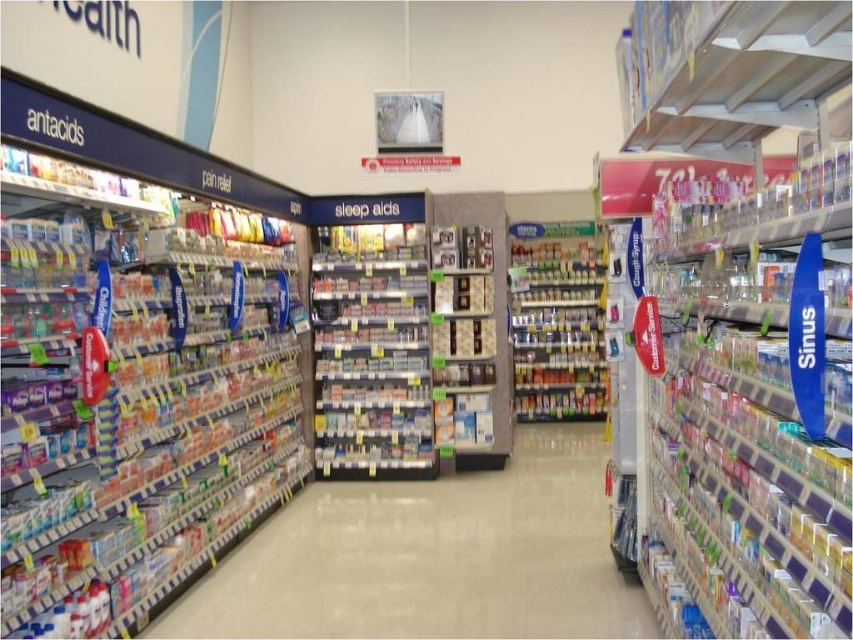
Question: Does white plastic shelves at center appear on the right side of metallic silver spice rack at center?

Choices:
 (A) yes
 (B) no

Answer: (B)

Question: Is white plastic shelves at center smaller than metallic silver spice rack at center?

Choices:
 (A) yes
 (B) no

Answer: (B)

Question: Which of these objects is positioned closest to the metallic silver spice rack at center?

Choices:
 (A) matte plastic antacids at left
 (B) white plastic shelves at center

Answer: (B)

Question: Which is farther from the matte plastic antacids at left?

Choices:
 (A) metallic silver spice rack at center
 (B) white plastic shelves at center

Answer: (A)

Question: Which point is closer to the camera?

Choices:
 (A) matte plastic antacids at left
 (B) white plastic shelves at center

Answer: (A)

Question: Does matte plastic antacids at left have a lesser width compared to metallic silver spice rack at center?

Choices:
 (A) no
 (B) yes

Answer: (B)